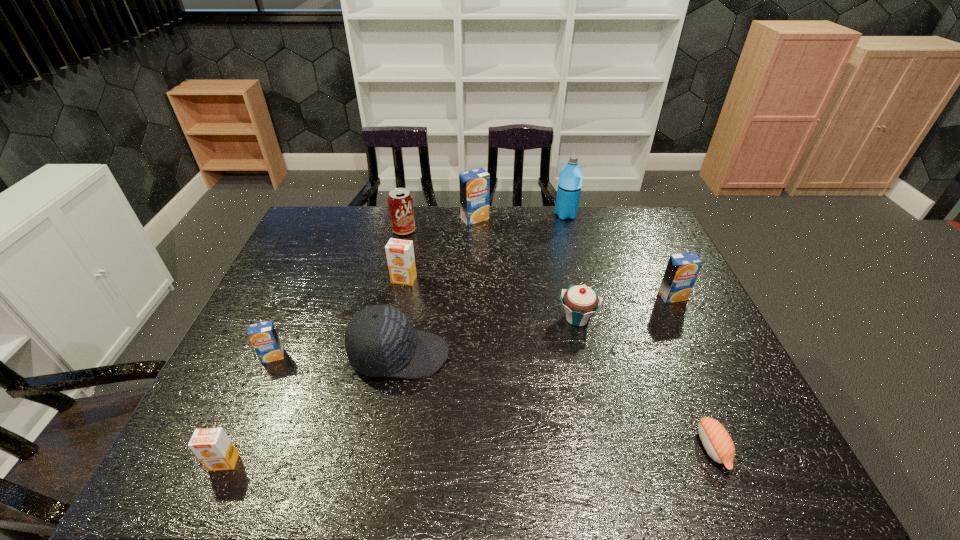
Find the location of a particular element. The height and width of the screenshot is (540, 960). empty location between the farther orange orange juice and the rightmost object is located at coordinates (539, 288).

Identify the location of free space that is in between the rightmost object and the left orange orange juice. (448, 380).

The height and width of the screenshot is (540, 960). What are the coordinates of `unoccupied position between the nearest blue orange_juice and the nearest orange juice` in the screenshot? It's located at (249, 409).

Identify the location of free space that is in between the leftmost blue orange_juice and the soda can. (339, 293).

Where is `empty space between the biggest blue orange_juice and the nearest blue orange_juice`? The image size is (960, 540). empty space between the biggest blue orange_juice and the nearest blue orange_juice is located at coordinates (374, 287).

The image size is (960, 540). I want to click on vacant region between the red soda can and the tallest object, so click(485, 222).

What are the coordinates of `free space between the fourth farthest orange juice and the seventh nearest object` in the screenshot? It's located at (339, 318).

Locate which object ranks seventh in proximity to the third orange juice from right to left. Please provide its 2D coordinates. Your answer should be formatted as a tuple, i.e. [(x, y)], where the tuple contains the x and y coordinates of a point satisfying the conditions above.

[(212, 446)]

Select which object appears as the fifth closest to the rightmost blue orange_juice. Please provide its 2D coordinates. Your answer should be formatted as a tuple, i.e. [(x, y)], where the tuple contains the x and y coordinates of a point satisfying the conditions above.

[(380, 341)]

Where is `orange juice that stands as the fourth closest to the soda can`? orange juice that stands as the fourth closest to the soda can is located at coordinates (682, 270).